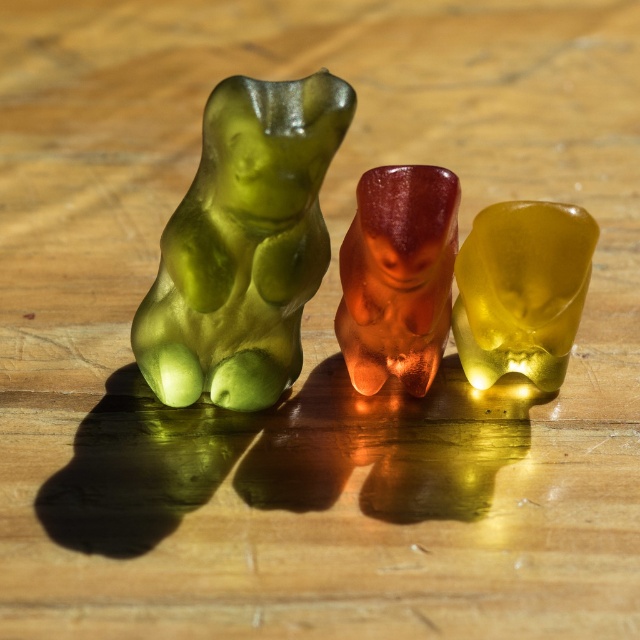
Question: Which of the following is the closest to the observer?

Choices:
 (A) green translucent bear at center
 (B) translucent yellow bear at center

Answer: (A)

Question: Is translucent amber bear at center positioned before translucent yellow bear at center?

Choices:
 (A) no
 (B) yes

Answer: (B)

Question: Which point is closer to the camera?

Choices:
 (A) green translucent bear at center
 (B) translucent amber bear at center

Answer: (A)

Question: Is green translucent bear at center above translucent amber bear at center?

Choices:
 (A) no
 (B) yes

Answer: (B)

Question: Which object is positioned closest to the translucent yellow bear at center?

Choices:
 (A) translucent amber bear at center
 (B) green translucent bear at center

Answer: (A)

Question: Is translucent amber bear at center thinner than translucent yellow bear at center?

Choices:
 (A) yes
 (B) no

Answer: (A)